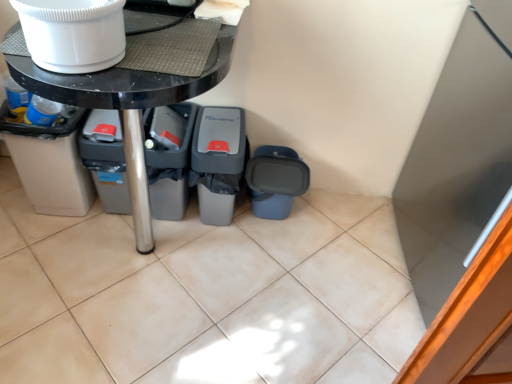
Image resolution: width=512 pixels, height=384 pixels. I want to click on vacant region to the left of white glossy refrigerator at upper right, so click(x=334, y=273).